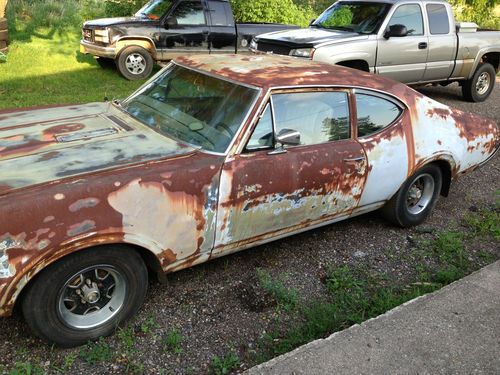
The height and width of the screenshot is (375, 500). I want to click on pedestal, so click(3, 26).